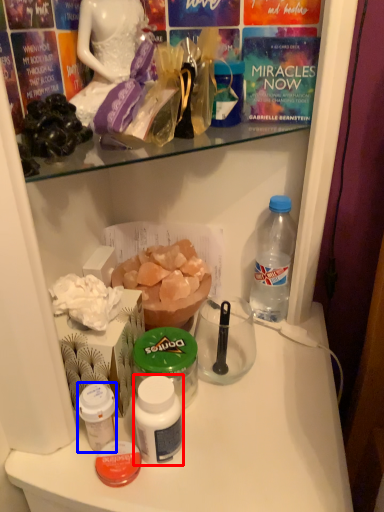
Question: Which object appears farthest to the camera in this image, bottle (highlighted by a red box) or bottle (highlighted by a blue box)?

Choices:
 (A) bottle
 (B) bottle

Answer: (B)